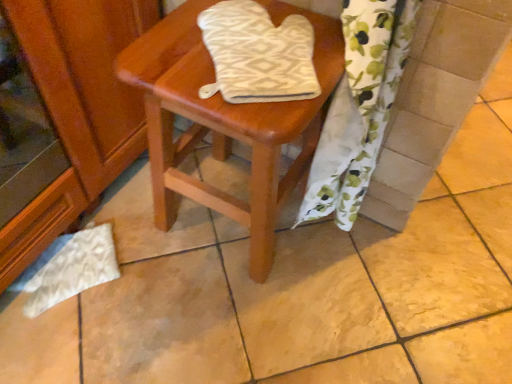
The height and width of the screenshot is (384, 512). I want to click on unoccupied area in front of wooden stool at center, so click(223, 323).